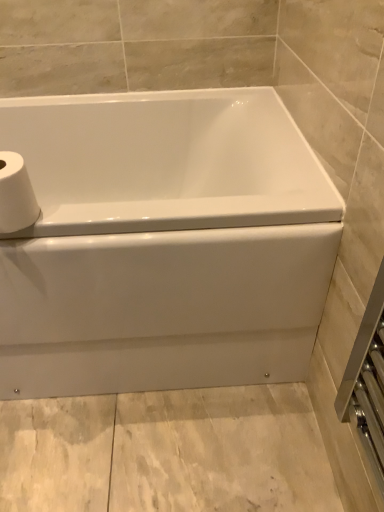
Where is `white glossy bathtub at center`? white glossy bathtub at center is located at coordinates (163, 243).

Describe the element at coordinates (163, 243) in the screenshot. I see `white glossy bathtub at center` at that location.

This screenshot has height=512, width=384. Describe the element at coordinates (16, 194) in the screenshot. I see `white matte toilet paper at upper left` at that location.

Find the location of a particular element. white matte toilet paper at upper left is located at coordinates (16, 194).

The width and height of the screenshot is (384, 512). I want to click on white glossy bathtub at center, so click(x=163, y=243).

In the scene shown: Between white matte toilet paper at upper left and white glossy bathtub at center, which one appears on the right side from the viewer's perspective?

From the viewer's perspective, white glossy bathtub at center appears more on the right side.

Is white matte toilet paper at upper left in front of white glossy bathtub at center?

Yes, white matte toilet paper at upper left is closer to the viewer.

Which is less distant, (21, 167) or (133, 362)?

Point (21, 167) appears to be closer to the viewer than point (133, 362).

From the image's perspective, is white matte toilet paper at upper left above or below white glossy bathtub at center?

Clearly, from the image's perspective, white matte toilet paper at upper left is above white glossy bathtub at center.

From a real-world perspective, is white matte toilet paper at upper left positioned under white glossy bathtub at center based on gravity?

Actually, white matte toilet paper at upper left is physically above white glossy bathtub at center in the real world.

Looking at this image, is white matte toilet paper at upper left wider than white glossy bathtub at center?

In fact, white matte toilet paper at upper left might be narrower than white glossy bathtub at center.

Does white matte toilet paper at upper left have a greater height compared to white glossy bathtub at center?

Incorrect, the height of white matte toilet paper at upper left is not larger of that of white glossy bathtub at center.

Based on the photo, looking at the image, does white matte toilet paper at upper left seem bigger or smaller compared to white glossy bathtub at center?

Clearly, white matte toilet paper at upper left is smaller in size than white glossy bathtub at center.

Is white glossy bathtub at center a part of white matte toilet paper at upper left?

Definitely not — white glossy bathtub at center is not inside white matte toilet paper at upper left.

Is white matte toilet paper at upper left directly adjacent to white glossy bathtub at center?

No, white matte toilet paper at upper left is not with white glossy bathtub at center.

Is white matte toilet paper at upper left facing towards white glossy bathtub at center?

No.

I want to click on bathtub lying behind the white matte toilet paper at upper left, so click(x=163, y=243).

Is white glossy bathtub at center to the left of white matte toilet paper at upper left from the viewer's perspective?

Incorrect, white glossy bathtub at center is not on the left side of white matte toilet paper at upper left.

Does white glossy bathtub at center lie behind white matte toilet paper at upper left?

That is True.

Does point (312, 234) come closer to viewer compared to point (12, 186)?

No.

From the image's perspective, which one is positioned higher, white glossy bathtub at center or white matte toilet paper at upper left?

white matte toilet paper at upper left appears higher in the image.

From a real-world perspective, is white glossy bathtub at center positioned under white matte toilet paper at upper left based on gravity?

Yes, from a real-world perspective, white glossy bathtub at center is under white matte toilet paper at upper left.

Looking at their sizes, would you say white glossy bathtub at center is wider or thinner than white matte toilet paper at upper left?

In the image, white glossy bathtub at center appears to be wider than white matte toilet paper at upper left.

In terms of height, does white glossy bathtub at center look taller or shorter compared to white matte toilet paper at upper left?

Clearly, white glossy bathtub at center is taller compared to white matte toilet paper at upper left.

Is white glossy bathtub at center smaller than white matte toilet paper at upper left?

No, white glossy bathtub at center is not smaller than white matte toilet paper at upper left.

Is white glossy bathtub at center positioned beyond the bounds of white matte toilet paper at upper left?

Indeed, white glossy bathtub at center is completely outside white matte toilet paper at upper left.

Based on the photo, is white glossy bathtub at center far away from white matte toilet paper at upper left?

That's not correct — white glossy bathtub at center is a little close to white matte toilet paper at upper left.

Is white matte toilet paper at upper left at the back of white glossy bathtub at center?

No, white glossy bathtub at center is not facing away from white matte toilet paper at upper left.

The width and height of the screenshot is (384, 512). I want to click on bathtub that appears below the white matte toilet paper at upper left (from a real-world perspective), so click(163, 243).

Identify the location of toilet paper in front of the white glossy bathtub at center. Image resolution: width=384 pixels, height=512 pixels. (16, 194).

Locate an element on the screen. The height and width of the screenshot is (512, 384). toilet paper located on the left of white glossy bathtub at center is located at coordinates (16, 194).